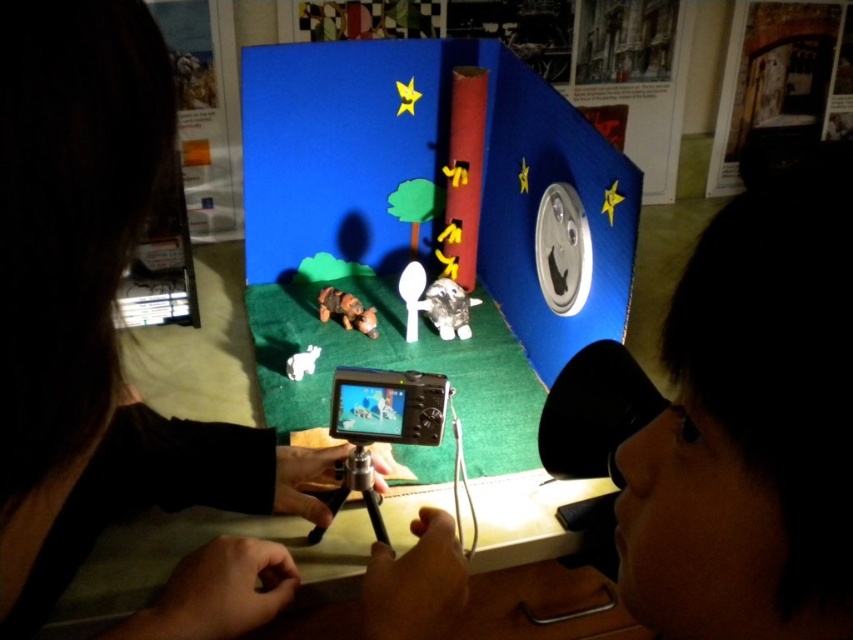
You are a visitor at this interactive exhibit and want to take a photo of the stop motion setup. The black matte camera at center and the matte plastic video game at center are both on the table. Which object should you move to the right to make space for your camera?

The black matte camera at center is to the left of the matte plastic video game at center, so you should move the matte plastic video game at center to the right to make space for your camera.

In the scene shown: You are an animator working on a stop motion project. You have a black matte camera at center that you need to position closer to the scene. The camera must be moved 10 centimeters forward. Is this possible without moving the tripod?

The black matte camera at center is currently 20.27 centimeters from the viewer. Moving it forward by 10 centimeters would bring it to 10.27 centimeters from the viewer, which is feasible as long as the tripod allows for such adjustment without needing to reposition the entire stand.

You are a photographer trying to set up a camera for a stop motion animation. The black matte camera at center is currently positioned at point 0.481, 0.111. If you want to move it to the right by 0.1 units, what would be the new coordinates?

The new coordinates would be approximately [94,371].